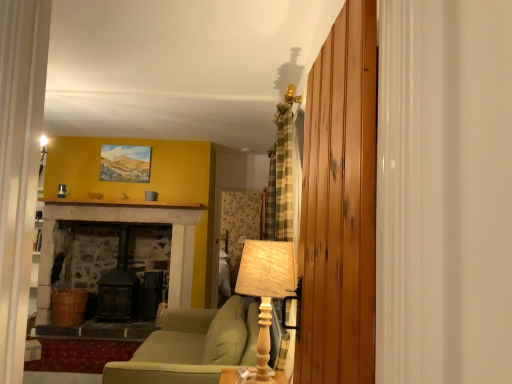
Question: Is woven fabric lampshade at right directly adjacent to green fabric couch at center?

Choices:
 (A) yes
 (B) no

Answer: (B)

Question: Is woven fabric lampshade at right smaller than green fabric couch at center?

Choices:
 (A) yes
 (B) no

Answer: (A)

Question: Can you confirm if woven fabric lampshade at right is shorter than green fabric couch at center?

Choices:
 (A) no
 (B) yes

Answer: (B)

Question: Is woven fabric lampshade at right outside green fabric couch at center?

Choices:
 (A) yes
 (B) no

Answer: (A)

Question: Could you tell me if woven fabric lampshade at right is turned towards green fabric couch at center?

Choices:
 (A) yes
 (B) no

Answer: (B)

Question: From a real-world perspective, is green fabric couch at center physically located above or below woven fabric lampshade at right?

Choices:
 (A) above
 (B) below

Answer: (B)

Question: Is green fabric couch at center inside or outside of woven fabric lampshade at right?

Choices:
 (A) inside
 (B) outside

Answer: (B)

Question: In the image, is green fabric couch at center positioned in front of or behind woven fabric lampshade at right?

Choices:
 (A) behind
 (B) front

Answer: (A)

Question: Considering the positions of green fabric couch at center and woven fabric lampshade at right in the image, is green fabric couch at center wider or thinner than woven fabric lampshade at right?

Choices:
 (A) wide
 (B) thin

Answer: (A)

Question: Is point (112, 374) closer or farther from the camera than point (354, 48)?

Choices:
 (A) farther
 (B) closer

Answer: (A)

Question: Looking at the image, does green fabric couch at center seem bigger or smaller compared to wooden planks at right?

Choices:
 (A) big
 (B) small

Answer: (A)

Question: Looking at their shapes, would you say green fabric couch at center is wider or thinner than wooden planks at right?

Choices:
 (A) thin
 (B) wide

Answer: (B)

Question: Is green fabric couch at center to the left or to the right of wooden planks at right in the image?

Choices:
 (A) right
 (B) left

Answer: (B)

Question: In terms of width, does wooden planks at right look wider or thinner when compared to woven fabric lampshade at right?

Choices:
 (A) wide
 (B) thin

Answer: (B)

Question: Is wooden planks at right inside or outside of woven fabric lampshade at right?

Choices:
 (A) outside
 (B) inside

Answer: (A)